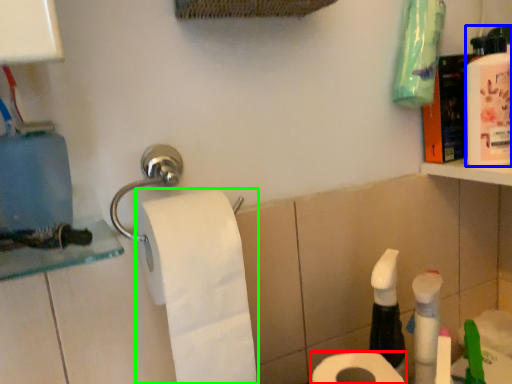
Question: Which is nearer to the toilet paper (highlighted by a red box)? mouthwash (highlighted by a blue box) or toilet paper (highlighted by a green box).

Choices:
 (A) mouthwash
 (B) toilet paper

Answer: (B)